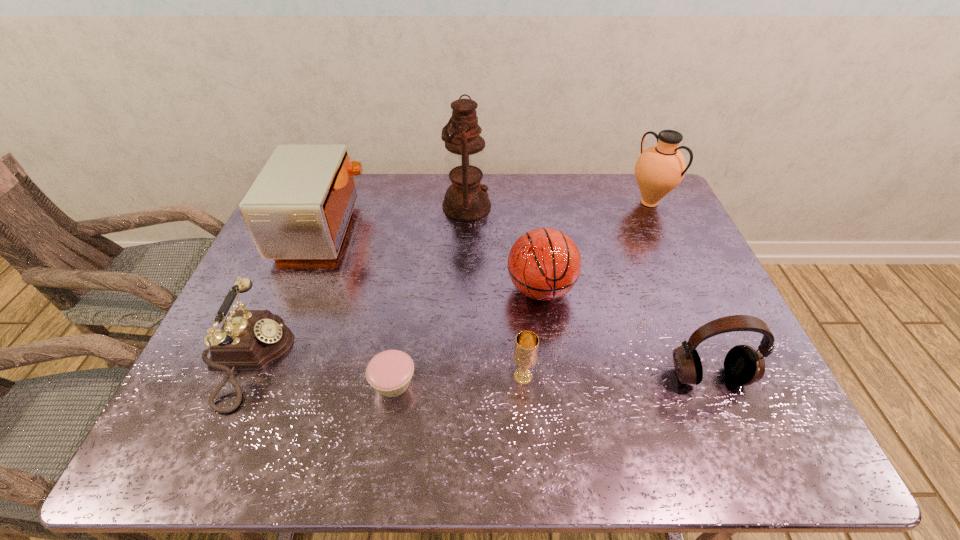
Identify the location of oil lamp. (466, 199).

Where is `the tallest object`? the tallest object is located at coordinates (466, 199).

This screenshot has height=540, width=960. I want to click on pitcher, so click(x=659, y=169).

Identify the location of toaster oven. The width and height of the screenshot is (960, 540). (298, 208).

The image size is (960, 540). Find the location of `headset`. headset is located at coordinates (743, 365).

The height and width of the screenshot is (540, 960). What are the coordinates of `basketball` in the screenshot? It's located at (544, 264).

Image resolution: width=960 pixels, height=540 pixels. In order to click on telephone in this screenshot , I will do `click(249, 340)`.

Find the location of a particular element. This screenshot has height=540, width=960. chalice is located at coordinates (525, 355).

In order to click on the shortest object in this screenshot , I will do `click(389, 372)`.

Locate an element on the screen. This screenshot has width=960, height=540. the third object from left to right is located at coordinates (389, 372).